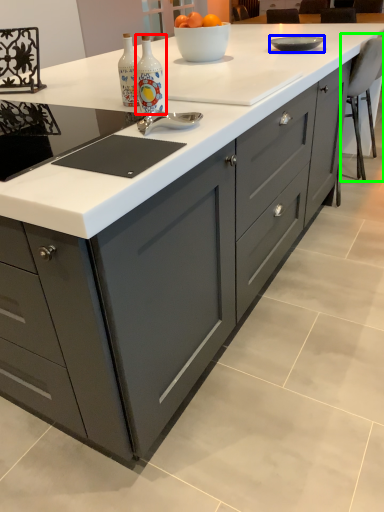
Question: Which is nearer to the bottle (highlighted by a red box)? bowl (highlighted by a blue box) or chair (highlighted by a green box).

Choices:
 (A) bowl
 (B) chair

Answer: (A)